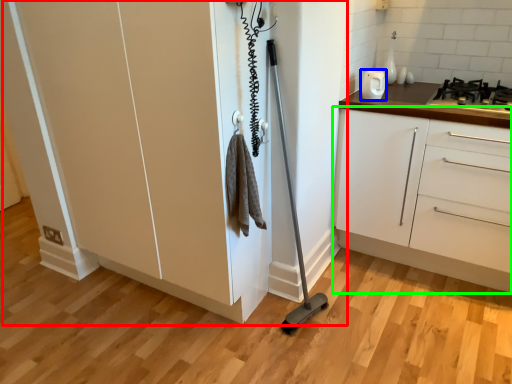
Question: Based on their relative distances, which object is farther from cupboard (highlighted by a red box)? Choose from home appliance (highlighted by a blue box) and cabinetry (highlighted by a green box).

Choices:
 (A) home appliance
 (B) cabinetry

Answer: (A)